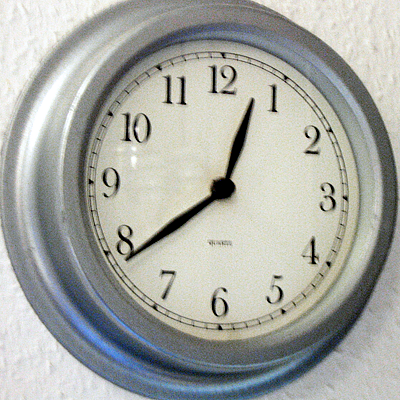
At what (x,y) coordinates should I click in order to perform the action: click on wall. Please return your answer as a coordinate pair (x, y). The height and width of the screenshot is (400, 400). Looking at the image, I should click on (28, 366).